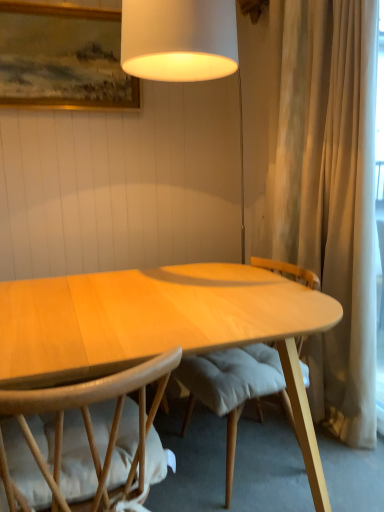
Question: Considering the positions of light brown wood chair at lower left and light wood desk at center in the image, is light brown wood chair at lower left bigger or smaller than light wood desk at center?

Choices:
 (A) big
 (B) small

Answer: (B)

Question: Is light brown wood chair at lower left inside the boundaries of light wood desk at center, or outside?

Choices:
 (A) outside
 (B) inside

Answer: (A)

Question: Estimate the real-world distances between objects in this image. Which object is closer to the wooden framed painting at upper left?

Choices:
 (A) light wood desk at center
 (B) light brown wood chair at lower left

Answer: (A)

Question: Which object is the closest to the wooden framed painting at upper left?

Choices:
 (A) light brown wood chair at lower left
 (B) light wood desk at center

Answer: (B)